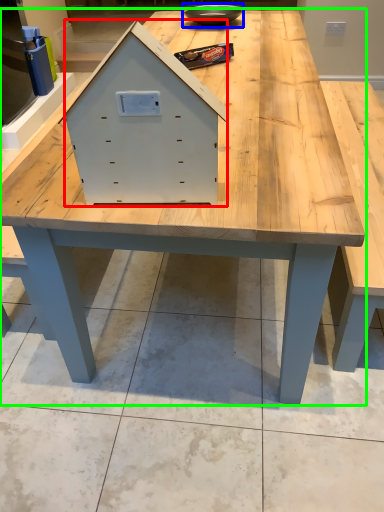
Question: Considering the real-world distances, which object is closest to drawer (highlighted by a red box)? bowl (highlighted by a blue box) or table (highlighted by a green box).

Choices:
 (A) bowl
 (B) table

Answer: (B)